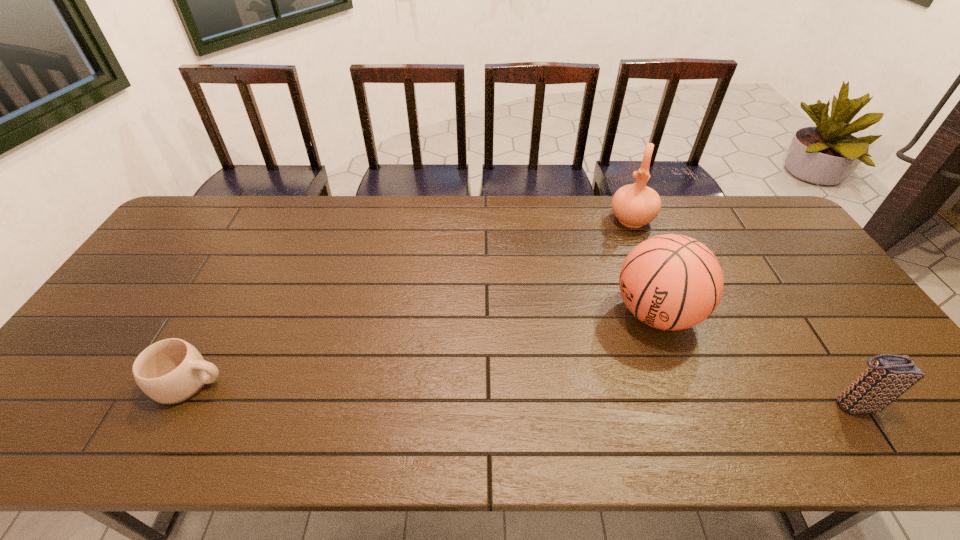
Identify the location of vacant space on the desktop that is between the leftmost object and the clutch bag and is positioned on the surface of the second farthest object near the brand logo. (544, 395).

This screenshot has height=540, width=960. In order to click on vacant space on the desktop that is between the mug and the clutch bag and is positioned on the spout of the farthest object in this screenshot , I will do `click(564, 395)`.